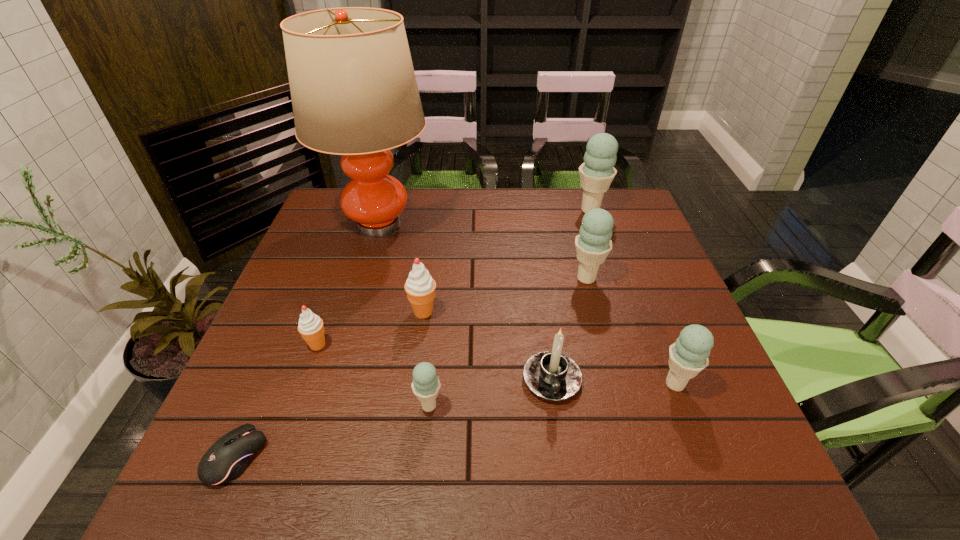
You are a GUI agent. You are given a task and a screenshot of the screen. Output one action in this format:
    pyautogui.click(x=<x>, y=<y>)
    Task: Click on the vacant area that lies between the fourth farthest object and the second smallest blue ice cream
    
    Given the screenshot: What is the action you would take?
    pyautogui.click(x=549, y=348)

Identify the location of free spot between the smallest blue ice cream and the third tallest object. The height and width of the screenshot is (540, 960). (508, 342).

The width and height of the screenshot is (960, 540). I want to click on free area in between the third tallest object and the tallest object, so click(x=483, y=251).

The image size is (960, 540). I want to click on blank region between the candle holder and the farthest ice cream, so click(x=571, y=295).

Locate an element on the screen. This screenshot has height=540, width=960. vacant region between the third biggest blue ice cream and the third nearest blue ice cream is located at coordinates (631, 331).

The image size is (960, 540). I want to click on vacant area that lies between the biggest blue ice cream and the sixth object from left to right, so click(571, 295).

I want to click on vacant space in between the fourth object from right to left and the third biggest blue ice cream, so click(613, 382).

Identify the location of vacant region between the third farthest ice cream and the second tallest object. This screenshot has width=960, height=540. (507, 261).

The width and height of the screenshot is (960, 540). I want to click on object that can be found as the third closest to the leftmost blue ice cream, so click(311, 328).

Locate which object is the second closest to the shortest object. Please provide its 2D coordinates. Your answer should be formatted as a tuple, i.e. [(x, y)], where the tuple contains the x and y coordinates of a point satisfying the conditions above.

[(426, 384)]